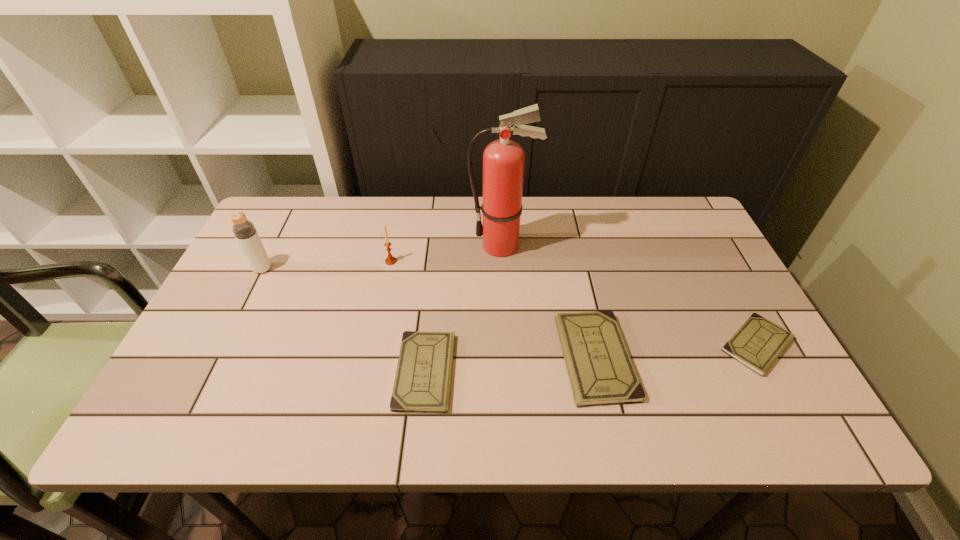
Locate an element on the screen. This screenshot has width=960, height=540. the fifth shortest object is located at coordinates (244, 230).

You are a GUI agent. You are given a task and a screenshot of the screen. Output one action in this format:
    pyautogui.click(x=<x>, y=<y>)
    Task: Click on the leftmost object
    
    Given the screenshot: What is the action you would take?
    pyautogui.click(x=244, y=230)

This screenshot has height=540, width=960. I want to click on vacant space located on the right of the second tallest checkbook, so click(x=530, y=372).

In order to click on vacant space located on the back of the fifth object from left to right in this screenshot , I will do `click(569, 238)`.

Locate an element on the screen. The width and height of the screenshot is (960, 540). vacant position located on the left of the shortest object is located at coordinates (552, 345).

Locate an element on the screen. This screenshot has height=540, width=960. vacant position located on the hose direction of the tallest object is located at coordinates (424, 246).

Find the location of a particular element. Image resolution: width=960 pixels, height=540 pixels. vacant space located 0.260m on the hose direction of the tallest object is located at coordinates (380, 246).

You are a GUI agent. You are given a task and a screenshot of the screen. Output one action in this format:
    pyautogui.click(x=<x>, y=<y>)
    Task: Click on the vacant area situated 0.280m on the hose direction of the tallest object
    
    Given the screenshot: What is the action you would take?
    pyautogui.click(x=372, y=246)

Where is `vacant region located 0.360m on the left of the fourth shortest object`? vacant region located 0.360m on the left of the fourth shortest object is located at coordinates (257, 261).

You are a GUI agent. You are given a task and a screenshot of the screen. Output one action in this format:
    pyautogui.click(x=<x>, y=<y>)
    Task: Click on the free space located 0.120m on the right of the second tallest object
    The image size is (960, 540).
    Given the screenshot: What is the action you would take?
    pyautogui.click(x=315, y=269)